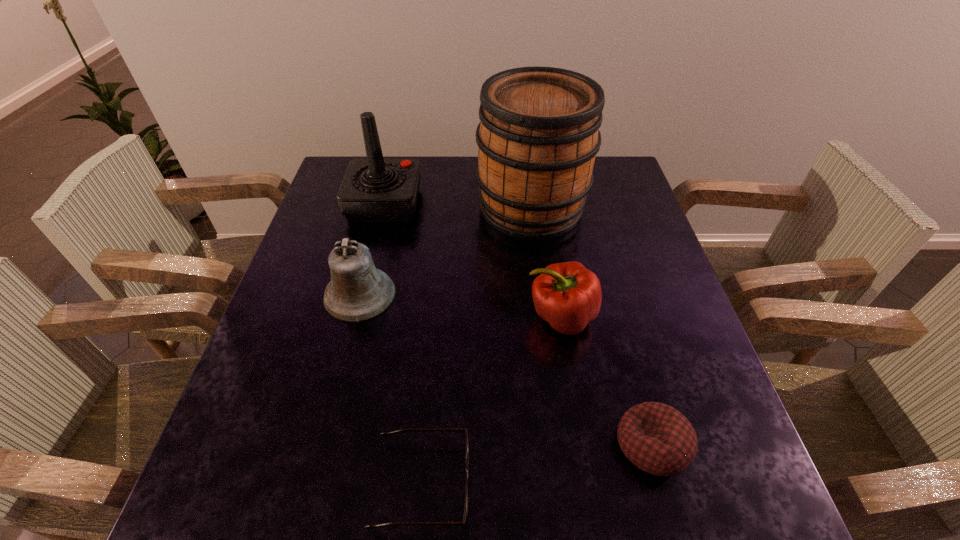
Where is `the second closest object relative to the cider`? This screenshot has height=540, width=960. the second closest object relative to the cider is located at coordinates (568, 296).

Where is `vacant space that satisfies the following two spatial constraints: 1. on the back side of the beanbag; 2. on the front-facing side of the second tallest object`? This screenshot has width=960, height=540. vacant space that satisfies the following two spatial constraints: 1. on the back side of the beanbag; 2. on the front-facing side of the second tallest object is located at coordinates (586, 204).

I want to click on vacant space that satisfies the following two spatial constraints: 1. on the front-facing side of the joystick; 2. on the left side of the second shortest object, so click(324, 445).

Locate an element on the screen. free point that satisfies the following two spatial constraints: 1. on the front-facing side of the beanbag; 2. on the right side of the joystick is located at coordinates (324, 445).